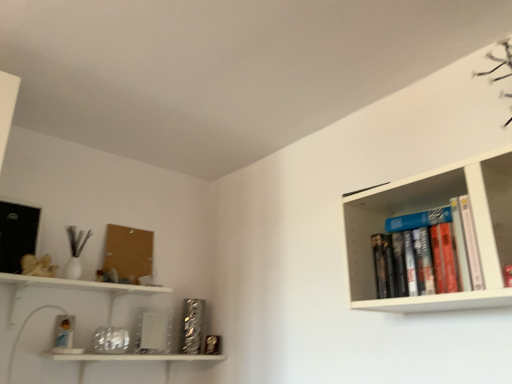
Question: Should I look upward or downward to see hardcover books at upper right?

Choices:
 (A) down
 (B) up

Answer: (A)

Question: Does corkboard at upper left have a lesser width compared to hardcover books at upper right?

Choices:
 (A) yes
 (B) no

Answer: (A)

Question: Can you confirm if corkboard at upper left is bigger than hardcover books at upper right?

Choices:
 (A) no
 (B) yes

Answer: (A)

Question: Is corkboard at upper left at the right side of hardcover books at upper right?

Choices:
 (A) yes
 (B) no

Answer: (B)

Question: Is corkboard at upper left at the left side of hardcover books at upper right?

Choices:
 (A) yes
 (B) no

Answer: (A)

Question: Is corkboard at upper left not near hardcover books at upper right?

Choices:
 (A) yes
 (B) no

Answer: (A)

Question: Is corkboard at upper left taller than hardcover books at upper right?

Choices:
 (A) no
 (B) yes

Answer: (B)

Question: Is hardcover books at upper right shorter than corkboard at upper left?

Choices:
 (A) no
 (B) yes

Answer: (B)

Question: Considering the relative sizes of hardcover books at upper right and corkboard at upper left in the image provided, is hardcover books at upper right smaller than corkboard at upper left?

Choices:
 (A) no
 (B) yes

Answer: (A)

Question: Would you say hardcover books at upper right contains corkboard at upper left?

Choices:
 (A) no
 (B) yes

Answer: (A)

Question: Considering the relative sizes of hardcover books at upper right and corkboard at upper left in the image provided, is hardcover books at upper right bigger than corkboard at upper left?

Choices:
 (A) yes
 (B) no

Answer: (A)

Question: From a real-world perspective, is hardcover books at upper right positioned over corkboard at upper left based on gravity?

Choices:
 (A) no
 (B) yes

Answer: (A)

Question: Considering the relative sizes of hardcover books at upper right and corkboard at upper left in the image provided, is hardcover books at upper right wider than corkboard at upper left?

Choices:
 (A) no
 (B) yes

Answer: (B)

Question: Relative to hardcover books at upper right, is corkboard at upper left in front or behind?

Choices:
 (A) front
 (B) behind

Answer: (B)